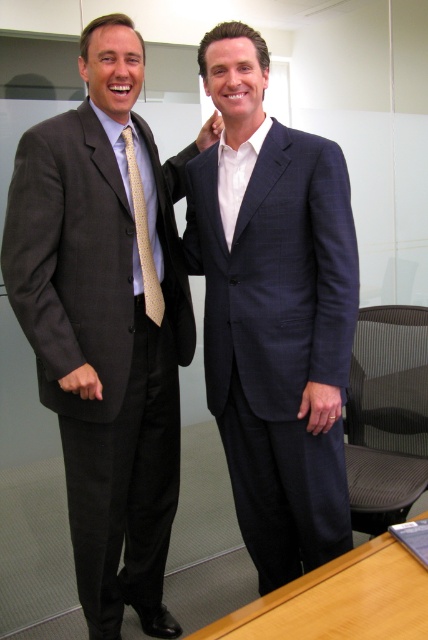
Does matte black suit at left appear over gold textured tie at left?

No.

The image size is (428, 640). Find the location of `matte black suit at left`. matte black suit at left is located at coordinates (107, 321).

This screenshot has height=640, width=428. I want to click on matte black suit at left, so click(107, 321).

Is matte black suit at left smaller than navy textured suit at center?

Actually, matte black suit at left might be larger than navy textured suit at center.

At what (x,y) coordinates should I click in order to perform the action: click on matte black suit at left. Please return your answer as a coordinate pair (x, y). Image resolution: width=428 pixels, height=640 pixels. Looking at the image, I should click on pos(107,321).

Locate an element on the screen. matte black suit at left is located at coordinates (107, 321).

Who is more distant from viewer, (247,129) or (128,173)?

Positioned behind is point (128,173).

Is point (347, 524) positioned behind point (128, 132)?

No, (347, 524) is in front of (128, 132).

I want to click on navy textured suit at center, so click(273, 314).